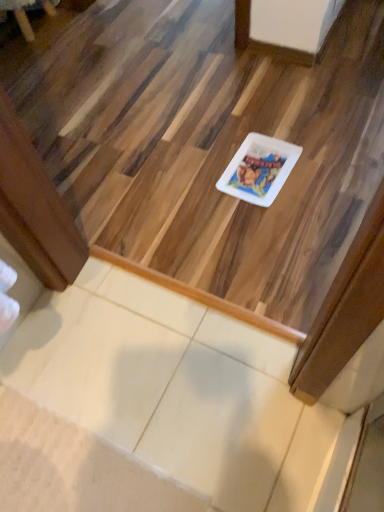
You are a GUI agent. You are given a task and a screenshot of the screen. Output one action in this format:
    pyautogui.click(x=<x>, y=<y>)
    Task: Click on the free point below white glossy plate at center (from a real-world perspective)
    This screenshot has width=384, height=512.
    Given the screenshot: What is the action you would take?
    pyautogui.click(x=260, y=170)